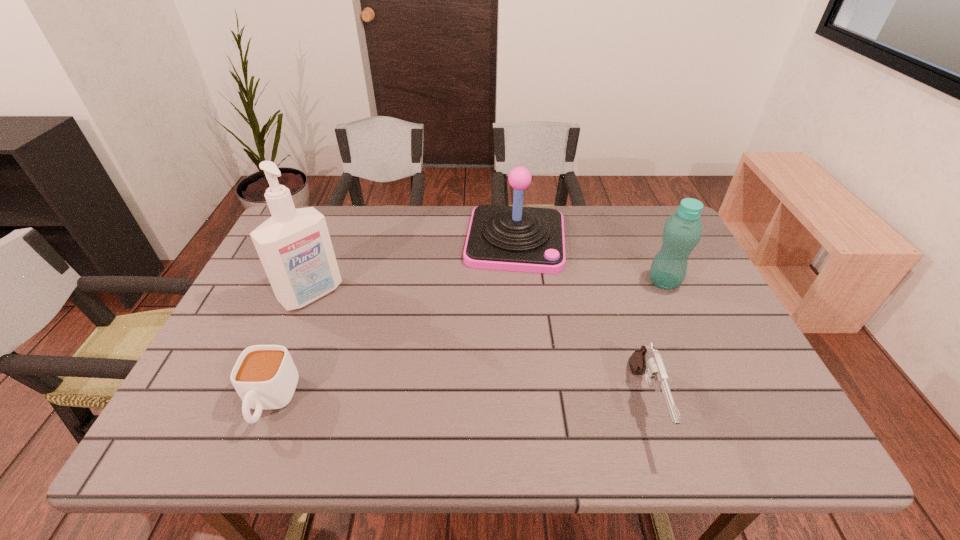
Identify the location of vacant spot on the desktop that is between the cup and the gun and is positioned on the front label of the cleansing agent. (421, 403).

This screenshot has height=540, width=960. I want to click on vacant space on the desktop that is between the shortest object and the fourth object from left to right and is positioned at the front cap of the rightmost object, so click(464, 403).

This screenshot has width=960, height=540. Find the location of `vacant space on the desktop that is between the shortest object and the fourth tallest object and is positioned forward from the base of the joystick`. vacant space on the desktop that is between the shortest object and the fourth tallest object and is positioned forward from the base of the joystick is located at coordinates (502, 403).